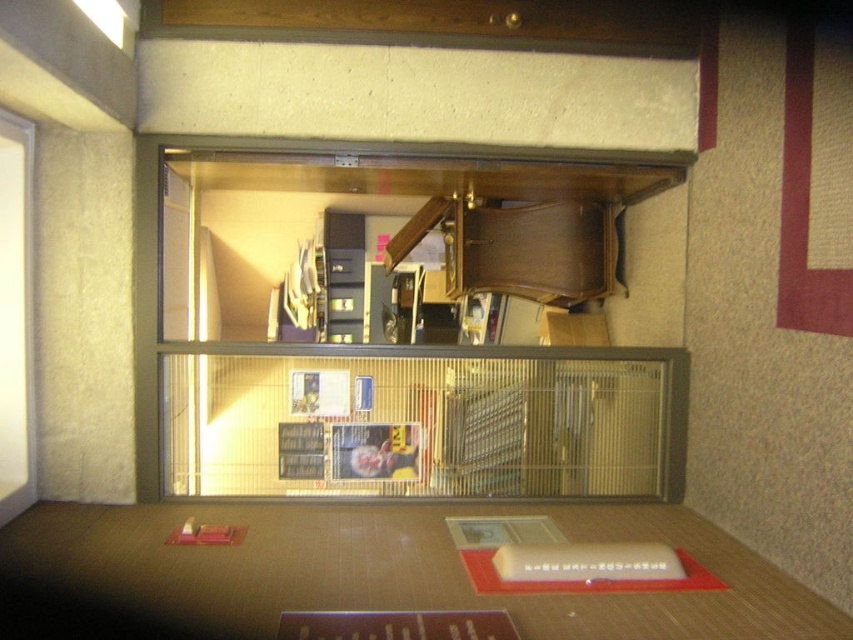
Question: Which point is closer to the camera?

Choices:
 (A) metallic wire cage at center
 (B) wooden shelf at center

Answer: (A)

Question: Which point is closer to the camera?

Choices:
 (A) wooden table at center
 (B) wooden shelf at center
 (C) metallic wire cage at center

Answer: (A)

Question: Is metallic wire cage at center closer to the viewer compared to wooden table at center?

Choices:
 (A) no
 (B) yes

Answer: (A)

Question: Which point is farther to the camera?

Choices:
 (A) metallic wire cage at center
 (B) wooden table at center

Answer: (A)

Question: Can you confirm if wooden shelf at center is positioned below wooden table at center?

Choices:
 (A) no
 (B) yes

Answer: (A)

Question: Is metallic wire cage at center thinner than wooden table at center?

Choices:
 (A) no
 (B) yes

Answer: (B)